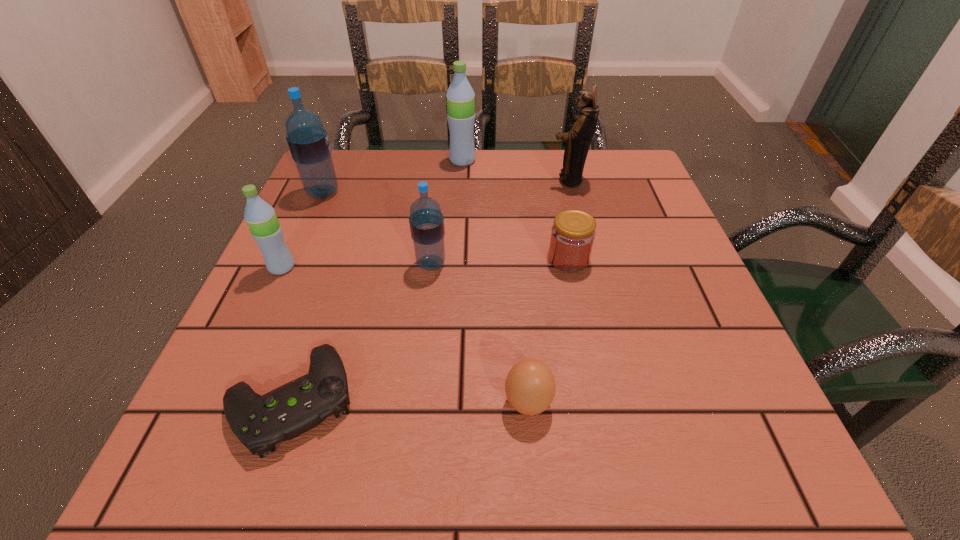
The height and width of the screenshot is (540, 960). Find the location of `vacant space located 0.290m on the back of the red jam`. vacant space located 0.290m on the back of the red jam is located at coordinates (549, 168).

Image resolution: width=960 pixels, height=540 pixels. I want to click on free location located on the right of the third object from right to left, so click(661, 403).

I want to click on vacant space situated on the right of the control, so click(586, 400).

Locate an element on the screen. figurine at the far edge is located at coordinates (578, 140).

This screenshot has height=540, width=960. Find the location of `boiled egg located at the near edge`. boiled egg located at the near edge is located at coordinates (530, 386).

What are the coordinates of `control situated at the near edge` in the screenshot? It's located at (260, 422).

Locate an element on the screen. control that is positioned at the left edge is located at coordinates (260, 422).

This screenshot has width=960, height=540. I want to click on object positioned at the right edge, so click(x=578, y=140).

Locate an element on the screen. The width and height of the screenshot is (960, 540). object located in the far left corner section of the desktop is located at coordinates (308, 142).

This screenshot has height=540, width=960. I want to click on object situated at the near left corner, so click(x=260, y=422).